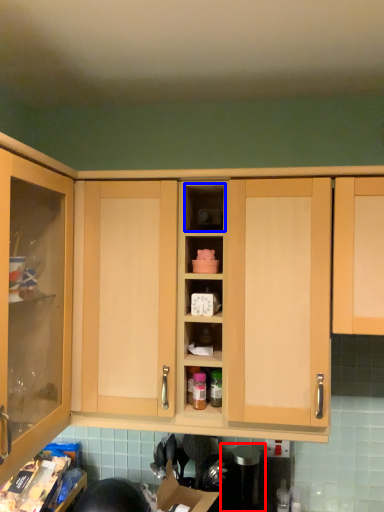
Question: Which point is further to the camera, appliance (highlighted by a red box) or cabinet (highlighted by a blue box)?

Choices:
 (A) appliance
 (B) cabinet

Answer: (A)